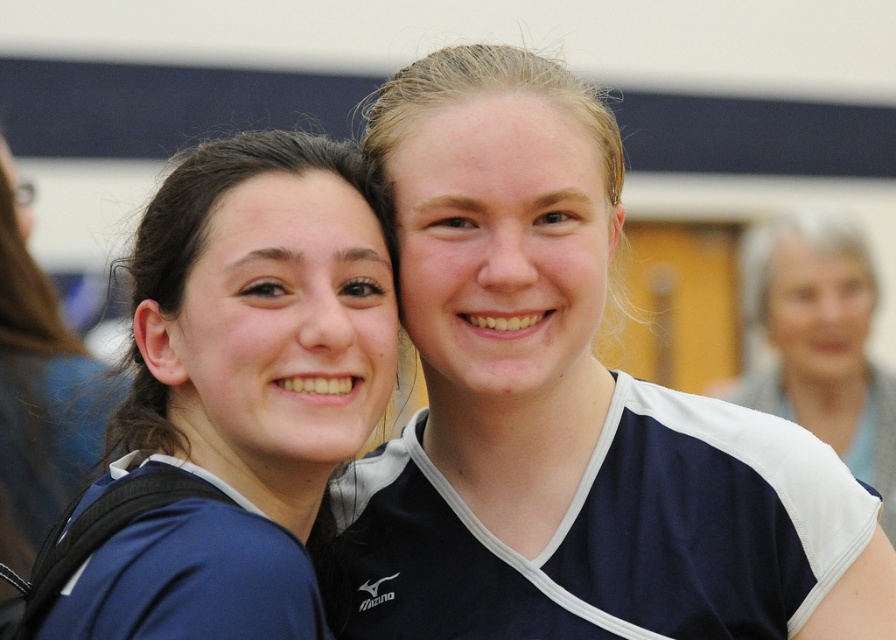
Does blue jersey at upper right have a greater width compared to matte blue jersey at left?

Indeed, blue jersey at upper right has a greater width compared to matte blue jersey at left.

In the scene shown: Can you confirm if blue jersey at upper right is positioned to the right of matte blue jersey at left?

Yes, blue jersey at upper right is to the right of matte blue jersey at left.

Which is behind, point (856, 288) or point (24, 440)?

The point (856, 288) is more distant.

Where is `blue jersey at upper right`? blue jersey at upper right is located at coordinates (820, 342).

Between blue jersey at left and matte blue jersey at left, which one appears on the right side from the viewer's perspective?

From the viewer's perspective, blue jersey at left appears more on the right side.

Is point (263, 333) closer to viewer compared to point (44, 496)?

Yes.

Identify the location of blue jersey at left. The height and width of the screenshot is (640, 896). point(242,388).

Is blue jersey at left to the right of blue jersey at upper right from the viewer's perspective?

In fact, blue jersey at left is to the left of blue jersey at upper right.

Looking at this image, is blue jersey at left wider than blue jersey at upper right?

In fact, blue jersey at left might be narrower than blue jersey at upper right.

The height and width of the screenshot is (640, 896). What are the coordinates of `blue jersey at left` in the screenshot? It's located at (242, 388).

The image size is (896, 640). I want to click on blue jersey at left, so coord(242,388).